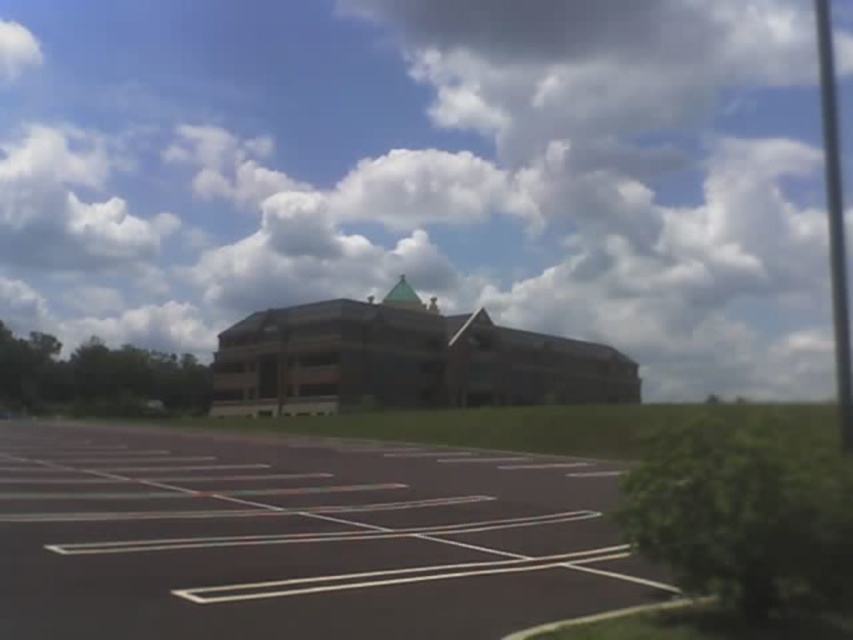
Consider the image. Looking at the cloudy sky at upper center and the black asphalt parking lot at center, which one has a larger area in the image?

The cloudy sky at upper center is bigger than the black asphalt parking lot at center, so the cloudy sky at upper center has a larger area in the image.

Consider the image. You are standing in front of the building and want to take a photo of the cloudy sky at upper center. According to the coordinates provided, where should you aim your camera?

The cloudy sky at upper center is located at coordinates point (425, 172), so you should aim your camera there.